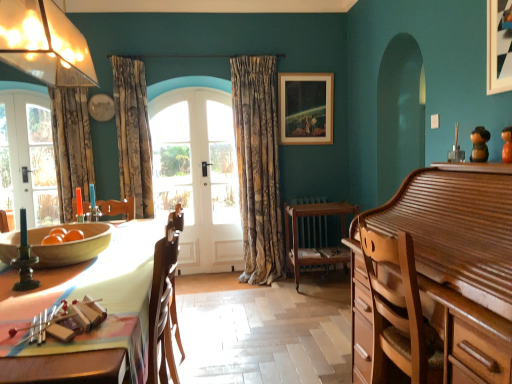
Question: In the image, is white glass door at center on the left side or the right side of wooden radiator at center?

Choices:
 (A) right
 (B) left

Answer: (B)

Question: From the image's perspective, relative to wooden radiator at center, is white glass door at center above or below?

Choices:
 (A) above
 (B) below

Answer: (A)

Question: Estimate the real-world distances between objects in this image. Which object is farther from the wooden bowl at table?

Choices:
 (A) floral fabric curtain at left, positioned as the third curtain in right-to-left order
 (B) wooden radiator at center
 (C) gold-patterned fabric curtain at center, which appears as the third curtain when viewed from the left
 (D) wooden chair at center
 (E) wooden table at center

Answer: (B)

Question: Which is farther from the translucent glass lampshade at upper left?

Choices:
 (A) white wooden door at center, the first door when ordered from right to left
 (B) wooden radiator at center
 (C) wooden chair at center
 (D) white glossy door at left, the first door viewed from the left
 (E) floral fabric curtain at left, positioned as the third curtain in right-to-left order

Answer: (B)